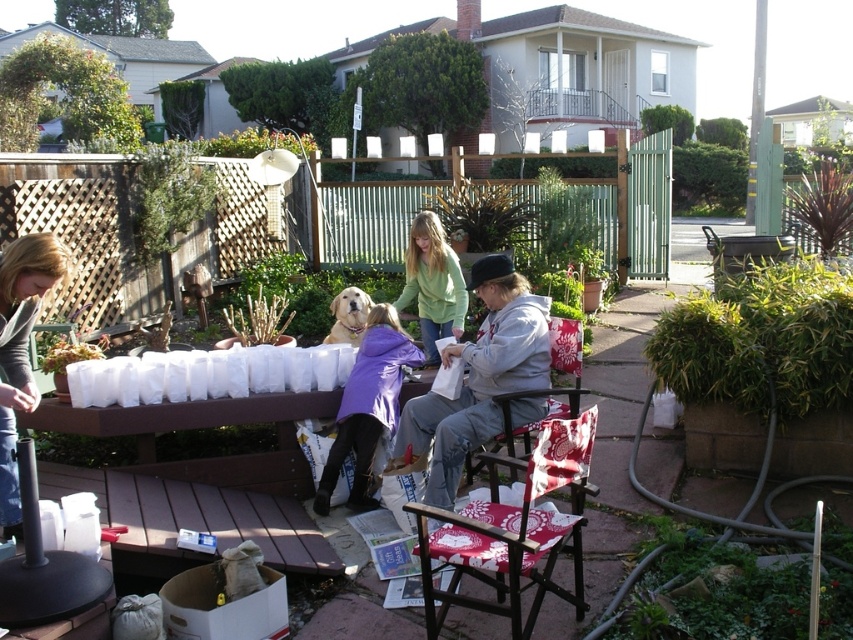
Question: Among these objects, which one is nearest to the camera?

Choices:
 (A) purple fleece jacket at center
 (B) green fleece jacket at center

Answer: (A)

Question: Is gray fleece jacket at center wider than floral fabric chair at center?

Choices:
 (A) no
 (B) yes

Answer: (B)

Question: Which of the following is the farthest from the observer?

Choices:
 (A) matte gray shirt at left
 (B) green fleece jacket at center

Answer: (B)

Question: Considering the real-world distances, which object is closest to the green fleece jacket at center?

Choices:
 (A) gray fleece jacket at center
 (B) matte gray shirt at left

Answer: (A)

Question: Is red floral fabric chair at center positioned behind matte gray shirt at left?

Choices:
 (A) yes
 (B) no

Answer: (B)

Question: Is purple fleece jacket at center further to the viewer compared to floral fabric chair at center?

Choices:
 (A) yes
 (B) no

Answer: (A)